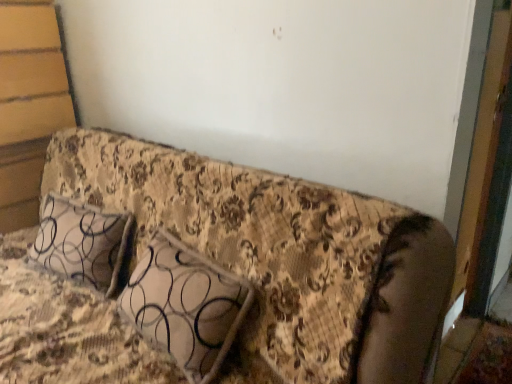
Question: Are patterned fabric pillow at center and floral fabric couch at center located far from each other?

Choices:
 (A) yes
 (B) no

Answer: (B)

Question: From the image's perspective, is patterned fabric pillow at center located beneath floral fabric couch at center?

Choices:
 (A) yes
 (B) no

Answer: (B)

Question: Considering the relative sizes of patterned fabric pillow at center and floral fabric couch at center in the image provided, is patterned fabric pillow at center bigger than floral fabric couch at center?

Choices:
 (A) no
 (B) yes

Answer: (A)

Question: Is patterned fabric pillow at center to the right of floral fabric couch at center from the viewer's perspective?

Choices:
 (A) no
 (B) yes

Answer: (B)

Question: Is patterned fabric pillow at center outside of floral fabric couch at center?

Choices:
 (A) no
 (B) yes

Answer: (A)

Question: From a real-world perspective, is patterned fabric pillow at center positioned over floral fabric couch at center based on gravity?

Choices:
 (A) no
 (B) yes

Answer: (B)

Question: Is floral fabric couch at center not inside patterned fabric pillow at center?

Choices:
 (A) yes
 (B) no

Answer: (A)

Question: Is patterned fabric pillow at center at the back of floral fabric couch at center?

Choices:
 (A) yes
 (B) no

Answer: (A)

Question: Does floral fabric couch at center have a greater width compared to patterned fabric pillow at center?

Choices:
 (A) no
 (B) yes

Answer: (B)

Question: From a real-world perspective, is floral fabric couch at center positioned over patterned fabric pillow at center based on gravity?

Choices:
 (A) yes
 (B) no

Answer: (B)

Question: Does floral fabric couch at center have a greater height compared to patterned fabric pillow at center?

Choices:
 (A) no
 (B) yes

Answer: (B)

Question: Is floral fabric couch at center far away from patterned fabric pillow at center?

Choices:
 (A) yes
 (B) no

Answer: (B)

Question: From the image's perspective, is patterned fabric pillow at center above or below floral fabric couch at center?

Choices:
 (A) above
 (B) below

Answer: (A)